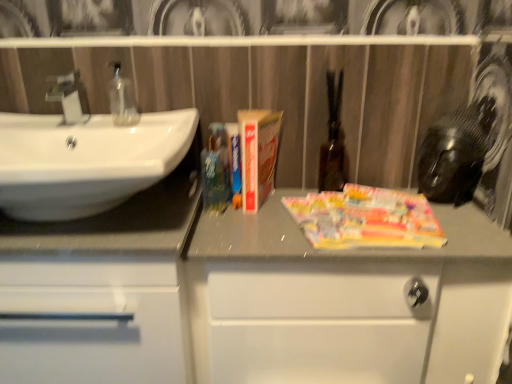
Question: From the image's perspective, is white glossy sink at left located above white matte cabinet at center, the first bathroom cabinet positioned from the right?

Choices:
 (A) yes
 (B) no

Answer: (A)

Question: Considering the relative sizes of white glossy sink at left and white matte cabinet at center, the 2th bathroom cabinet in the left-to-right sequence, in the image provided, is white glossy sink at left smaller than white matte cabinet at center, the 2th bathroom cabinet in the left-to-right sequence,?

Choices:
 (A) no
 (B) yes

Answer: (B)

Question: Is white glossy sink at left next to white matte cabinet at center, the 2th bathroom cabinet in the left-to-right sequence?

Choices:
 (A) yes
 (B) no

Answer: (B)

Question: Is white glossy sink at left facing towards white matte cabinet at center, the first bathroom cabinet positioned from the right?

Choices:
 (A) yes
 (B) no

Answer: (B)

Question: Considering the relative sizes of white glossy sink at left and white matte cabinet at center, the 2th bathroom cabinet in the left-to-right sequence, in the image provided, is white glossy sink at left wider than white matte cabinet at center, the 2th bathroom cabinet in the left-to-right sequence,?

Choices:
 (A) yes
 (B) no

Answer: (A)

Question: From a real-world perspective, relative to white glossy cabinet at left, the second bathroom cabinet when ordered from right to left, is hardcover book at center vertically above or below?

Choices:
 (A) above
 (B) below

Answer: (A)

Question: In the image, is hardcover book at center positioned in front of or behind white glossy cabinet at left, which appears as the 1th bathroom cabinet when viewed from the left?

Choices:
 (A) front
 (B) behind

Answer: (B)

Question: Is hardcover book at center taller or shorter than white glossy cabinet at left, which appears as the 1th bathroom cabinet when viewed from the left?

Choices:
 (A) short
 (B) tall

Answer: (A)

Question: Based on their sizes in the image, would you say hardcover book at center is bigger or smaller than white glossy cabinet at left, which appears as the 1th bathroom cabinet when viewed from the left?

Choices:
 (A) big
 (B) small

Answer: (B)

Question: Is point (267, 304) positioned closer to the camera than point (183, 340)?

Choices:
 (A) farther
 (B) closer

Answer: (B)

Question: In the image, is white matte cabinet at center, the first bathroom cabinet positioned from the right, positioned in front of or behind white glossy cabinet at left, which appears as the 1th bathroom cabinet when viewed from the left?

Choices:
 (A) behind
 (B) front

Answer: (A)

Question: Is white matte cabinet at center, the first bathroom cabinet positioned from the right, spatially inside white glossy cabinet at left, the second bathroom cabinet when ordered from right to left, or outside of it?

Choices:
 (A) inside
 (B) outside

Answer: (B)

Question: Is white matte cabinet at center, the first bathroom cabinet positioned from the right, taller or shorter than white glossy cabinet at left, the second bathroom cabinet when ordered from right to left?

Choices:
 (A) tall
 (B) short

Answer: (B)

Question: Is transparent glass soap at left in front of or behind matte silver faucet at left in the image?

Choices:
 (A) front
 (B) behind

Answer: (B)

Question: Is point (121, 122) positioned closer to the camera than point (45, 96)?

Choices:
 (A) farther
 (B) closer

Answer: (B)